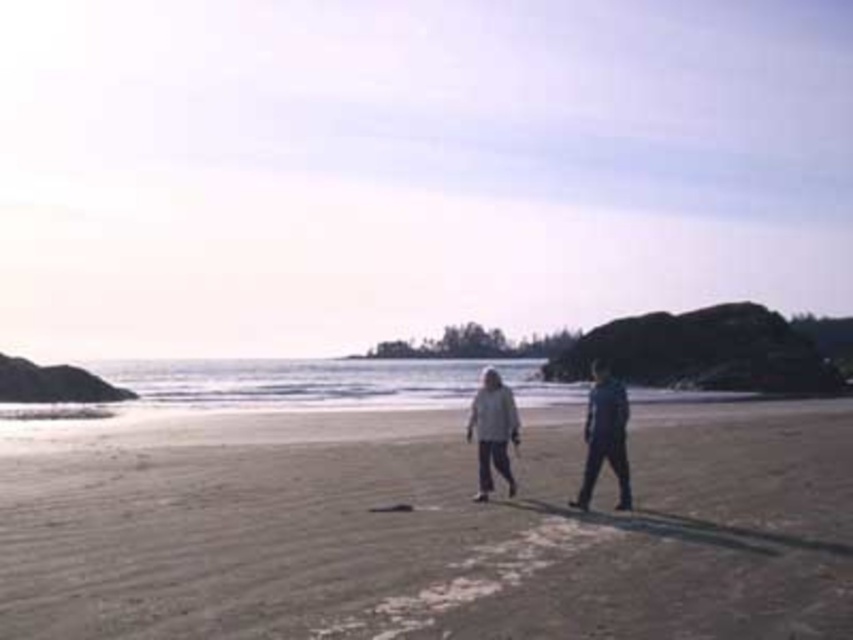
You are standing on the beach and see the white fabric couple at center and the light gray fabric pants at center. Which one is nearer to you?

The white fabric couple at center is closer to the viewer than the light gray fabric pants at center.

Based on the coordinates provided, what object is located at point (605,435) in the beach scene?

The point (605,435) corresponds to the white fabric couple at center.